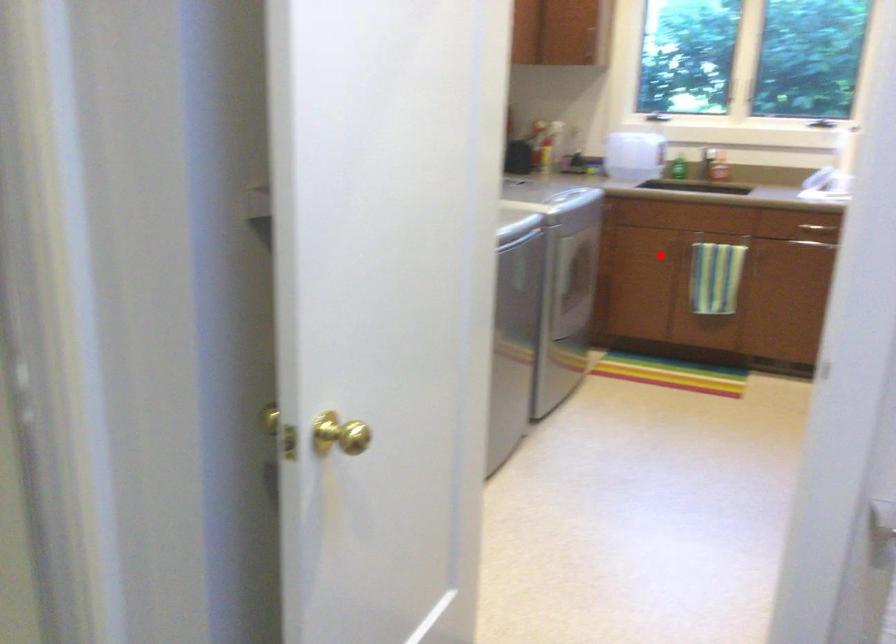
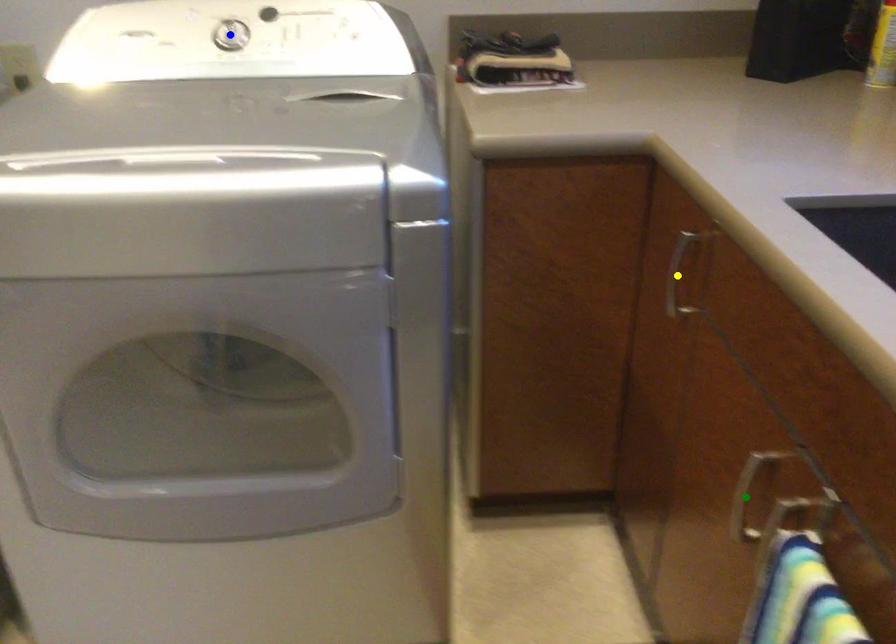
Question: I am providing you with two images of the same scene from different viewpoints. A red point is marked on the first image. You are given multiple points on the second image. Which point in image 2 represents the same 3d spot as the red point in image 1?

Choices:
 (A) yellow point
 (B) blue point
 (C) green point

Answer: (C)